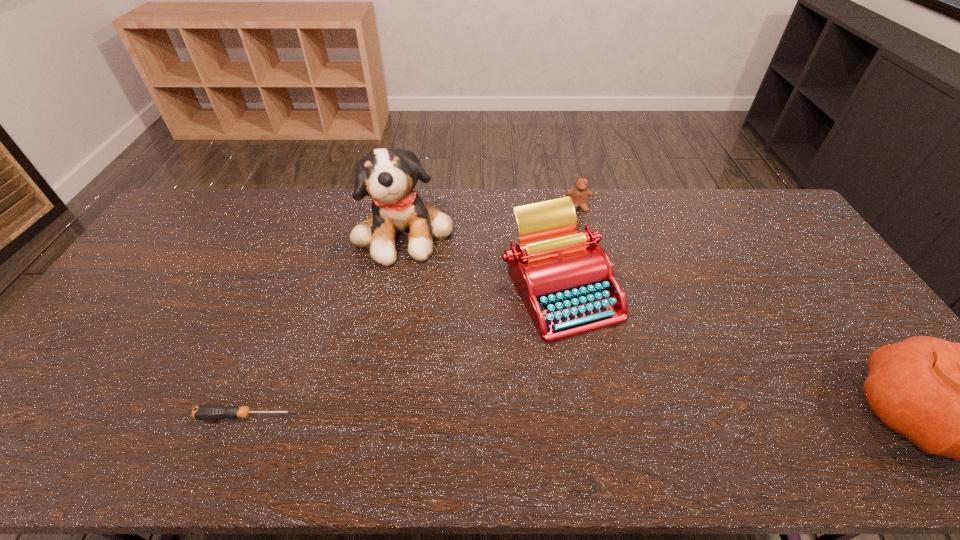
Find the location of a particular element. the shortest object is located at coordinates (208, 411).

Locate an element on the screen. This screenshot has height=540, width=960. the leftmost object is located at coordinates (208, 411).

You are a GUI agent. You are given a task and a screenshot of the screen. Output one action in this format:
    pyautogui.click(x=<x>, y=<y>)
    Task: Click on the fourth tallest object
    This screenshot has width=960, height=540.
    Given the screenshot: What is the action you would take?
    pyautogui.click(x=579, y=195)

You are a GUI agent. You are given a task and a screenshot of the screen. Output one action in this format:
    pyautogui.click(x=<x>, y=<y>)
    Task: Click on the third shortest object
    This screenshot has height=540, width=960.
    Given the screenshot: What is the action you would take?
    pyautogui.click(x=567, y=284)

Image resolution: width=960 pixels, height=540 pixels. I want to click on puppy, so tap(388, 176).

Where is `the tallest object`? The width and height of the screenshot is (960, 540). the tallest object is located at coordinates (388, 176).

The image size is (960, 540). Identify the location of vacant region located at the tip of the screwdriver. (x=65, y=416).

Where is `free space located 0.310m at the tip of the screwdriver`? This screenshot has height=540, width=960. free space located 0.310m at the tip of the screwdriver is located at coordinates (65, 416).

Find the location of a particular element. The height and width of the screenshot is (540, 960). vacant area situated at the tip of the screwdriver is located at coordinates (141, 416).

This screenshot has width=960, height=540. Find the location of `free space located on the face of the fourth tallest object`. free space located on the face of the fourth tallest object is located at coordinates (586, 262).